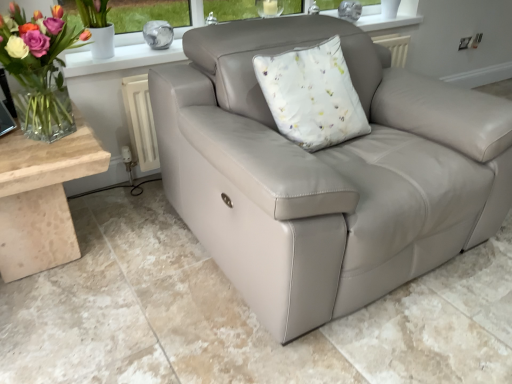
Find the location of a particular element. This screenshot has width=512, height=384. free space to the right of beige marble table at lower left is located at coordinates (155, 260).